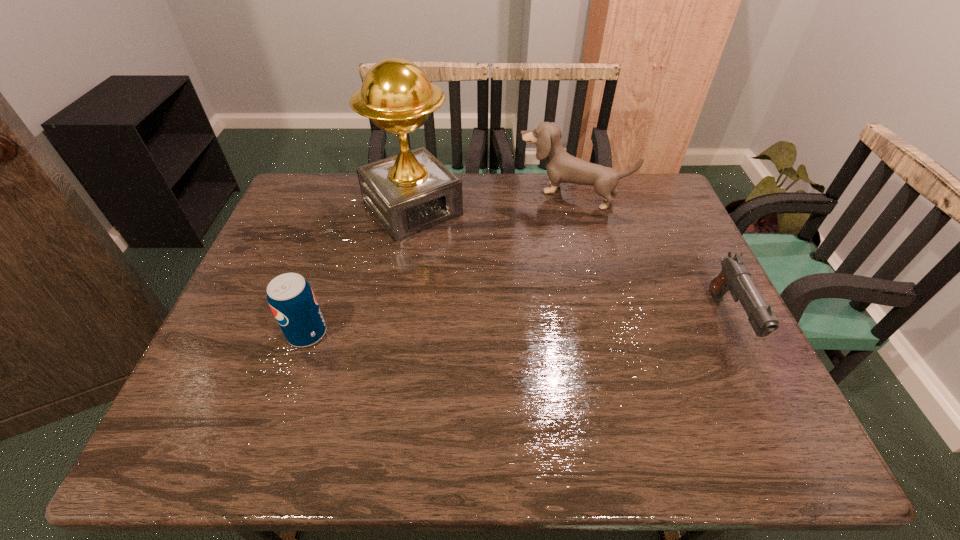
The image size is (960, 540). I want to click on free location at the near edge, so click(x=427, y=369).

Where is `vacant area at the left edge`? The height and width of the screenshot is (540, 960). vacant area at the left edge is located at coordinates (277, 343).

This screenshot has height=540, width=960. Find the location of `vacant space at the right edge`. vacant space at the right edge is located at coordinates (664, 268).

The width and height of the screenshot is (960, 540). In order to click on free space at the far left corner in this screenshot , I will do `click(324, 181)`.

Where is `blank space at the near left corner of the desktop`? This screenshot has height=540, width=960. blank space at the near left corner of the desktop is located at coordinates (260, 394).

The width and height of the screenshot is (960, 540). Identify the location of free area in between the rightmost object and the second tallest object. (649, 256).

You are a GUI agent. You are given a task and a screenshot of the screen. Output one action in this format:
    pyautogui.click(x=<x>, y=<y>)
    Task: Click on the vacant space in between the award and the gun
    The width and height of the screenshot is (960, 540).
    Given the screenshot: What is the action you would take?
    pyautogui.click(x=570, y=264)

Find the location of a particular element. The width and height of the screenshot is (960, 540). free space between the puppy and the award is located at coordinates (492, 201).

Identify the location of unoccupied area between the third object from left to right and the award. The width and height of the screenshot is (960, 540). (492, 201).

At what (x,y) coordinates should I click in order to perform the action: click on vacant area that lies between the second tallest object and the pop. Please return your answer as a coordinate pair (x, y). Looking at the image, I should click on (439, 264).